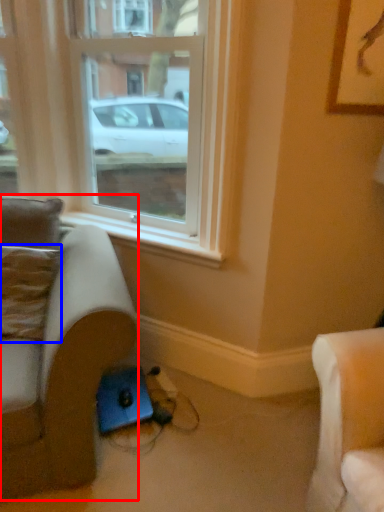
Question: Which of the following is the closest to the observer, studio couch (highlighted by a red box) or pillow (highlighted by a blue box)?

Choices:
 (A) studio couch
 (B) pillow

Answer: (A)